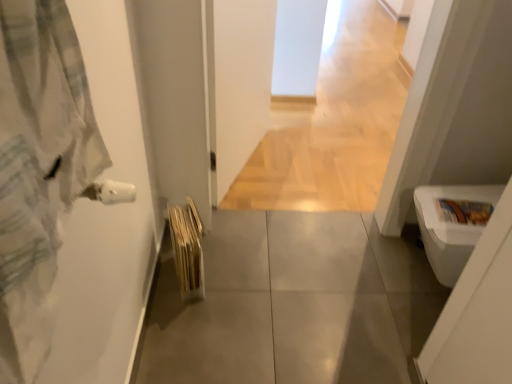
Question: Could you tell me if light gray flannel bathrobe at left is facing gray tile floor at center?

Choices:
 (A) no
 (B) yes

Answer: (A)

Question: Is light gray flannel bathrobe at left to the left of gray tile floor at center from the viewer's perspective?

Choices:
 (A) no
 (B) yes

Answer: (B)

Question: From a real-world perspective, is light gray flannel bathrobe at left located beneath gray tile floor at center?

Choices:
 (A) yes
 (B) no

Answer: (B)

Question: Considering the relative sizes of light gray flannel bathrobe at left and gray tile floor at center in the image provided, is light gray flannel bathrobe at left shorter than gray tile floor at center?

Choices:
 (A) no
 (B) yes

Answer: (A)

Question: Would you consider light gray flannel bathrobe at left to be distant from gray tile floor at center?

Choices:
 (A) no
 (B) yes

Answer: (B)

Question: From the image's perspective, is light wood floor at center positioned above or below gray tile floor at center?

Choices:
 (A) above
 (B) below

Answer: (A)

Question: From a real-world perspective, is light wood floor at center physically located above or below gray tile floor at center?

Choices:
 (A) above
 (B) below

Answer: (B)

Question: Is light wood floor at center inside the boundaries of gray tile floor at center, or outside?

Choices:
 (A) outside
 (B) inside

Answer: (A)

Question: In the image, is light wood floor at center positioned in front of or behind gray tile floor at center?

Choices:
 (A) front
 (B) behind

Answer: (B)

Question: In terms of height, does white glossy toilet bowl at lower right look taller or shorter compared to light gray flannel bathrobe at left?

Choices:
 (A) short
 (B) tall

Answer: (B)

Question: From a real-world perspective, relative to light gray flannel bathrobe at left, is white glossy toilet bowl at lower right vertically above or below?

Choices:
 (A) above
 (B) below

Answer: (B)

Question: Considering the positions of point (441, 248) and point (28, 306), is point (441, 248) closer or farther from the camera than point (28, 306)?

Choices:
 (A) closer
 (B) farther

Answer: (B)

Question: Is white glossy toilet bowl at lower right in front of or behind light gray flannel bathrobe at left in the image?

Choices:
 (A) behind
 (B) front

Answer: (A)

Question: In the image, is light gray flannel bathrobe at left positioned in front of or behind white glossy toilet bowl at lower right?

Choices:
 (A) front
 (B) behind

Answer: (A)

Question: From the image's perspective, is light gray flannel bathrobe at left located above or below white glossy toilet bowl at lower right?

Choices:
 (A) below
 (B) above

Answer: (B)